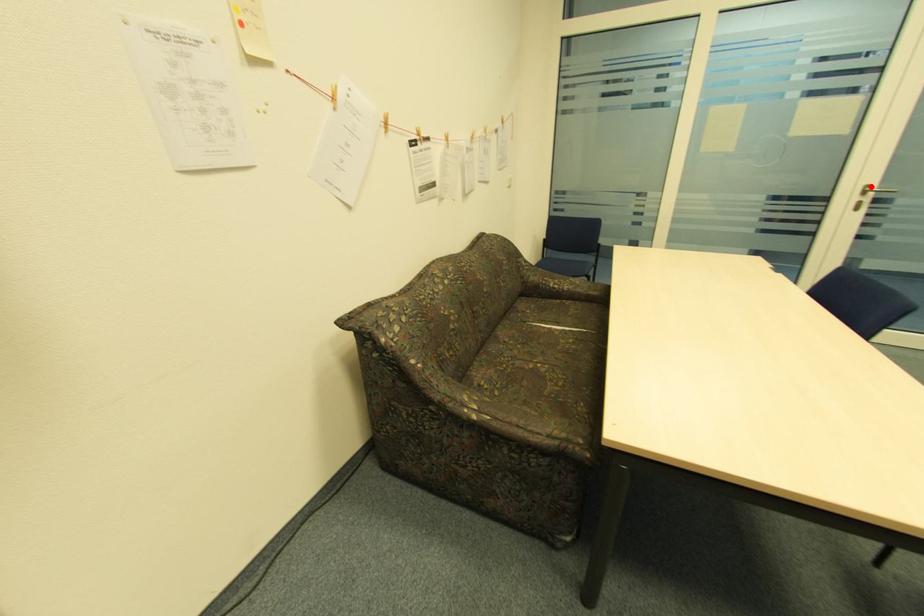
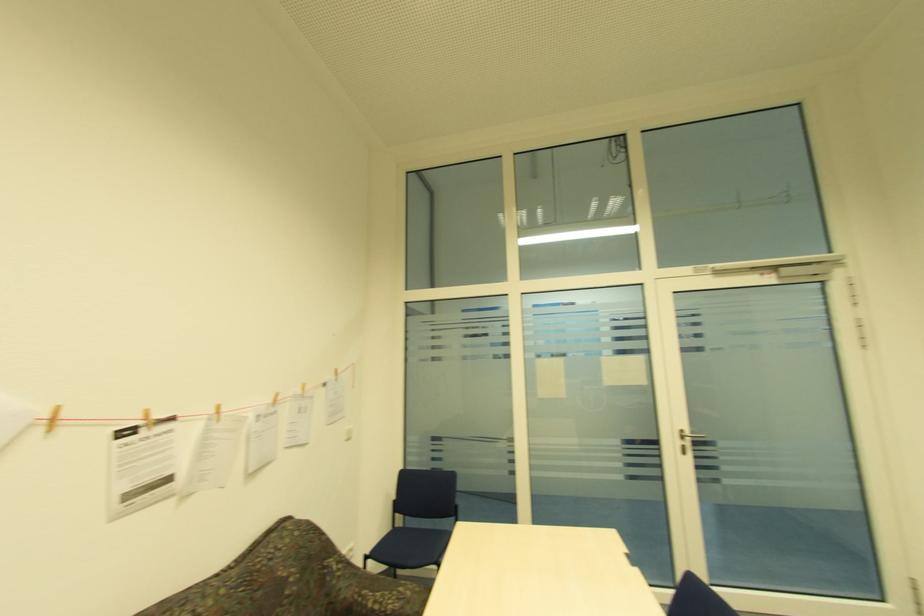
Question: A red point is marked in image1. In image2, is the corresponding 3D point closer to the camera or farther? Reply with the corresponding letter.

Choices:
 (A) The corresponding 3D point is closer.
 (B) The corresponding 3D point is farther.

Answer: (A)